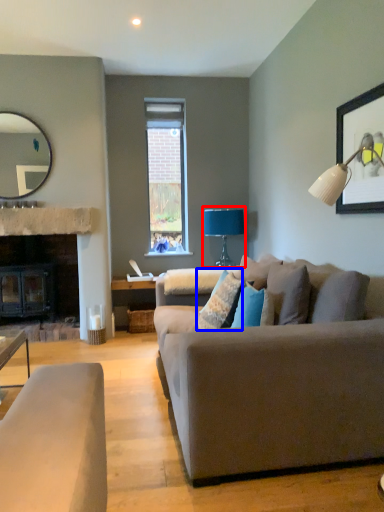
Question: Among these objects, which one is farthest to the camera, table lamp (highlighted by a red box) or pillow (highlighted by a blue box)?

Choices:
 (A) table lamp
 (B) pillow

Answer: (A)